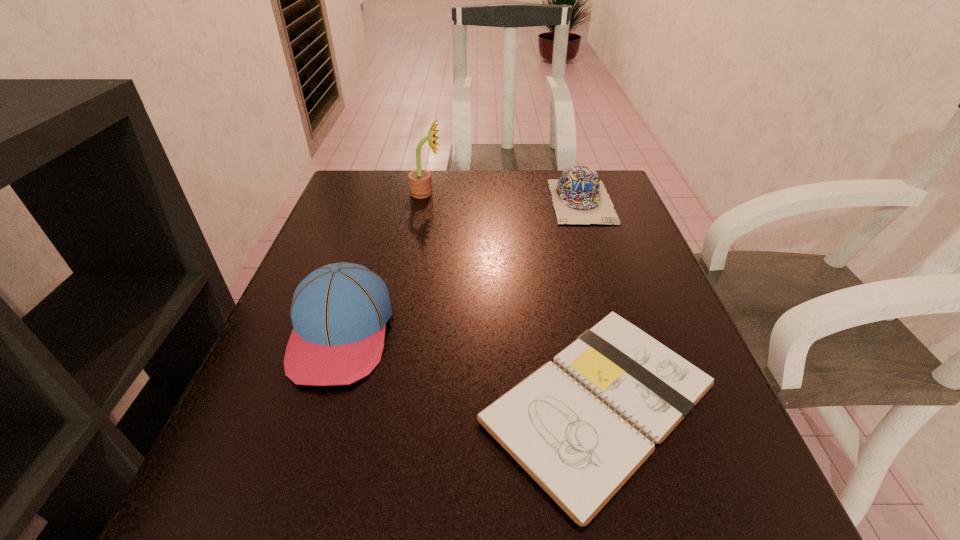
Locate an element on the screen. The width and height of the screenshot is (960, 540). sunflower is located at coordinates (420, 183).

Locate an element on the screen. The image size is (960, 540). baseball cap is located at coordinates (339, 312).

Locate an element on the screen. cap is located at coordinates (579, 197).

At what (x,y) coordinates should I click in order to perform the action: click on the shortest object. Please return your answer as a coordinate pair (x, y). Image resolution: width=960 pixels, height=540 pixels. Looking at the image, I should click on 580,426.

Find the location of a particular element. The height and width of the screenshot is (540, 960). vacant region located on the face of the sunflower is located at coordinates (592, 193).

Find the location of `vacant area situated on the front-facing side of the third shortest object`. vacant area situated on the front-facing side of the third shortest object is located at coordinates (291, 493).

I want to click on vacant area situated 0.180m on the front, side, and top of the cap, so click(x=606, y=275).

The height and width of the screenshot is (540, 960). I want to click on vacant space located 0.060m on the left of the shortest object, so click(x=439, y=402).

This screenshot has width=960, height=540. In order to click on sunflower at the far edge in this screenshot , I will do `click(420, 183)`.

The image size is (960, 540). What are the coordinates of `cap at the far edge` in the screenshot? It's located at (579, 197).